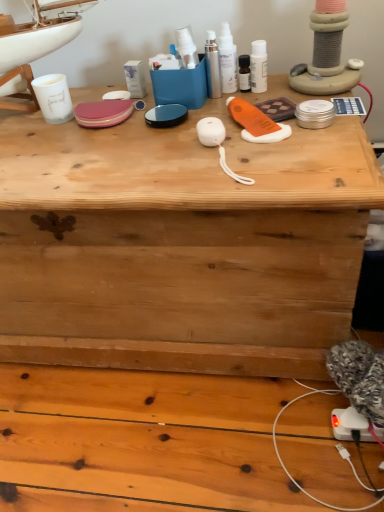
Question: From a real-world perspective, is white glossy lotion at upper center, which is counted as the 3th toiletry, starting from the left, below white glossy spray bottles at upper center, arranged as the 2th toiletry when viewed from the left?

Choices:
 (A) yes
 (B) no

Answer: (A)

Question: Is white glossy lotion at upper center, which is counted as the 3th toiletry, starting from the left, positioned far away from white glossy spray bottles at upper center, arranged as the 2th toiletry when viewed from the left?

Choices:
 (A) yes
 (B) no

Answer: (B)

Question: Is white glossy lotion at upper center, which is counted as the 3th toiletry, starting from the left, at the left side of white glossy spray bottles at upper center, acting as the second toiletry starting from the right?

Choices:
 (A) no
 (B) yes

Answer: (A)

Question: Is white glossy spray bottles at upper center, acting as the second toiletry starting from the right, located within white glossy lotion at upper center, positioned as the first toiletry in right-to-left order?

Choices:
 (A) no
 (B) yes

Answer: (A)

Question: From the image's perspective, does white glossy lotion at upper center, positioned as the first toiletry in right-to-left order, appear lower than white glossy spray bottles at upper center, acting as the second toiletry starting from the right?

Choices:
 (A) yes
 (B) no

Answer: (A)

Question: Is white glossy lotion at upper center, which is counted as the 3th toiletry, starting from the left, looking in the opposite direction of white glossy spray bottles at upper center, arranged as the 2th toiletry when viewed from the left?

Choices:
 (A) no
 (B) yes

Answer: (A)

Question: Is white glossy spray bottles at upper center, arranged as the 2th toiletry when viewed from the left, located within sleek silver spray at center, the 1th toiletry viewed from the left?

Choices:
 (A) no
 (B) yes

Answer: (A)

Question: Is sleek silver spray at center, the 1th toiletry viewed from the left, bigger than white glossy spray bottles at upper center, acting as the second toiletry starting from the right?

Choices:
 (A) no
 (B) yes

Answer: (A)

Question: Is sleek silver spray at center, arranged as the third toiletry when viewed from the right, wider than white glossy spray bottles at upper center, acting as the second toiletry starting from the right?

Choices:
 (A) yes
 (B) no

Answer: (B)

Question: Could you tell me if sleek silver spray at center, the 1th toiletry viewed from the left, is turned towards white glossy spray bottles at upper center, arranged as the 2th toiletry when viewed from the left?

Choices:
 (A) no
 (B) yes

Answer: (A)

Question: From the image's perspective, would you say sleek silver spray at center, arranged as the third toiletry when viewed from the right, is shown under white glossy spray bottles at upper center, arranged as the 2th toiletry when viewed from the left?

Choices:
 (A) no
 (B) yes

Answer: (B)

Question: Is sleek silver spray at center, arranged as the third toiletry when viewed from the right, positioned beyond the bounds of white glossy spray bottles at upper center, arranged as the 2th toiletry when viewed from the left?

Choices:
 (A) no
 (B) yes

Answer: (B)

Question: From the image's perspective, is sleek silver spray at center, the 1th toiletry viewed from the left, located beneath white glossy lotion at upper center, which is counted as the 3th toiletry, starting from the left?

Choices:
 (A) yes
 (B) no

Answer: (B)